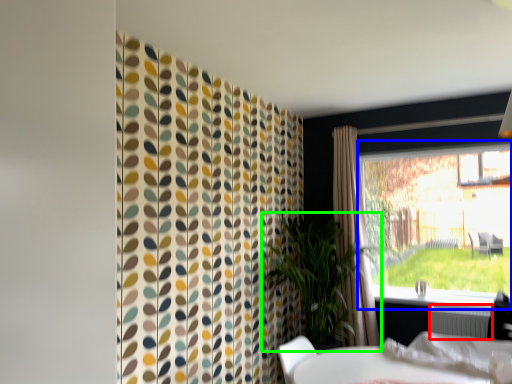
Question: Which is nearer to the radiator (highlighted by a red box)? window (highlighted by a blue box) or houseplant (highlighted by a green box).

Choices:
 (A) window
 (B) houseplant

Answer: (B)